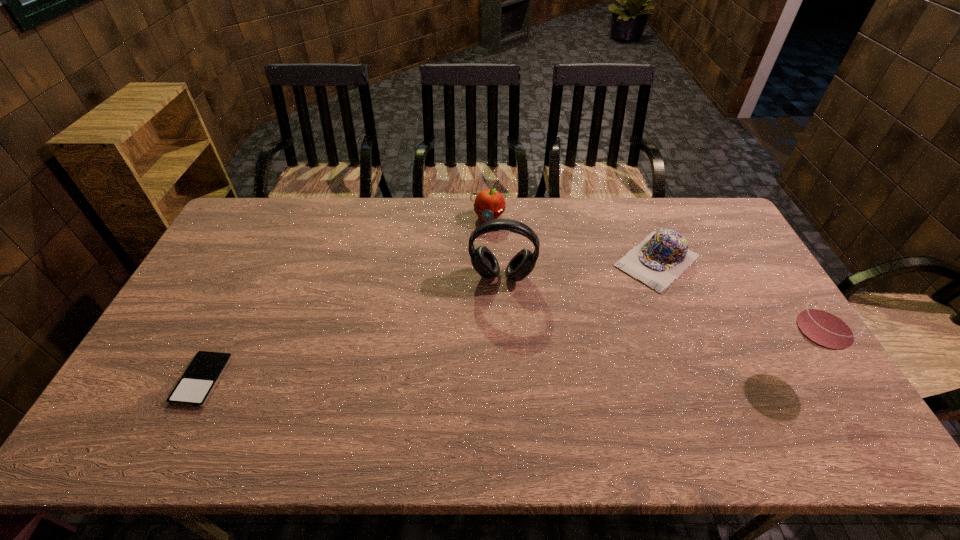
Find the location of a particular element. This screenshot has width=960, height=540. iPod is located at coordinates (194, 388).

I want to click on the shortest object, so click(194, 388).

At what (x,y) coordinates should I click in order to perform the action: click on wineglass. Please return your answer as a coordinate pair (x, y). Image resolution: width=960 pixels, height=540 pixels. Looking at the image, I should click on (828, 324).

Find the location of a particular element. The image size is (960, 540). headset is located at coordinates coord(483,260).

This screenshot has height=540, width=960. In order to click on the second object from right to left in this screenshot , I will do `click(661, 258)`.

At what (x,y) coordinates should I click in order to perform the action: click on the second shortest object. Please return your answer as a coordinate pair (x, y). Looking at the image, I should click on (661, 258).

You are a GUI agent. You are given a task and a screenshot of the screen. Output one action in this format:
    pyautogui.click(x=<x>, y=<y>)
    Task: Click on the apple
    The image size is (960, 540).
    Given the screenshot: What is the action you would take?
    pyautogui.click(x=489, y=204)

Where is `the farthest object`? This screenshot has width=960, height=540. the farthest object is located at coordinates (489, 204).

Locate an element on the screen. free space located on the right of the shortest object is located at coordinates (377, 380).

Identify the location of free space located 0.320m on the left of the wineglass. coord(646,368).